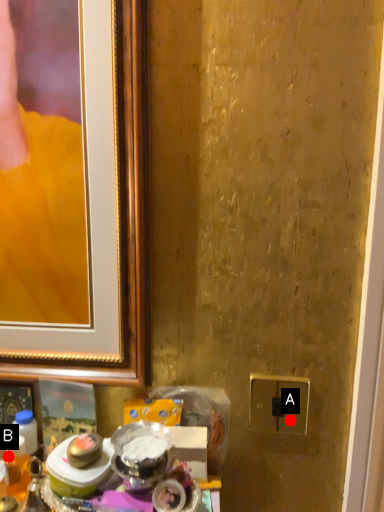
Question: Two points are circled on the image, labeled by A and B beside each circle. Which point is farther to the camera?

Choices:
 (A) A is further
 (B) B is further

Answer: (A)